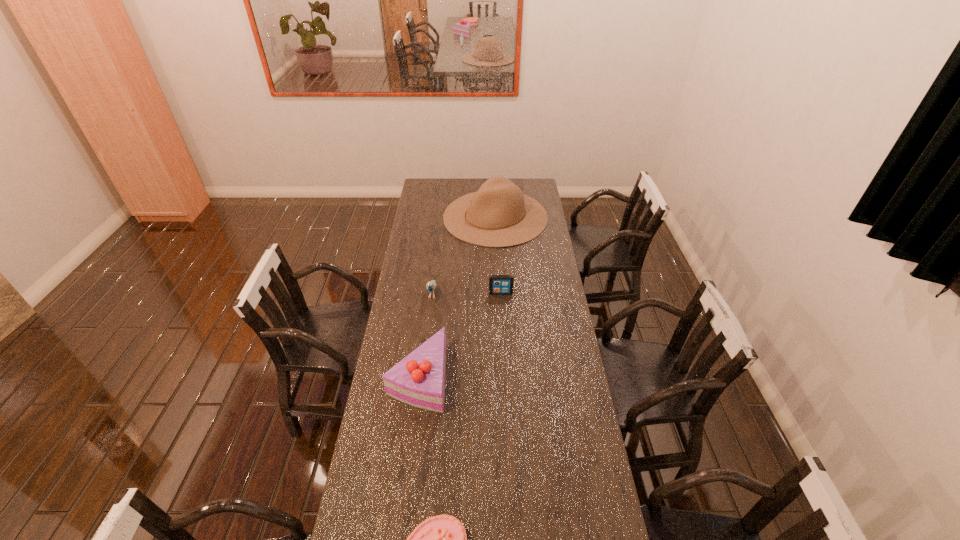
Locate an element on the screen. The width and height of the screenshot is (960, 540). empty space between the fourth farthest object and the tallest object is located at coordinates (457, 297).

This screenshot has width=960, height=540. Identify the location of empty space that is in between the second tallest object and the sombrero. (457, 297).

At what (x,y) coordinates should I click in order to perform the action: click on free space between the second shortest object and the taller cake. Please return your answer as a coordinate pair (x, y). Looking at the image, I should click on (460, 335).

Locate an element on the screen. Image resolution: width=960 pixels, height=540 pixels. the fourth closest object to the second nearest object is located at coordinates tap(498, 215).

Locate an element on the screen. object that is the fourth closest to the iPod is located at coordinates (442, 539).